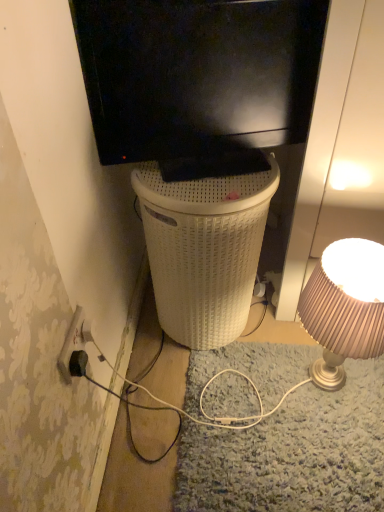
Question: Is white woven basket at center next to black matte television at upper center?

Choices:
 (A) yes
 (B) no

Answer: (B)

Question: Is the position of white woven basket at center more distant than that of black matte television at upper center?

Choices:
 (A) no
 (B) yes

Answer: (B)

Question: Could you tell me if white woven basket at center is turned towards black matte television at upper center?

Choices:
 (A) yes
 (B) no

Answer: (B)

Question: From the image's perspective, does white woven basket at center appear higher than black matte television at upper center?

Choices:
 (A) no
 (B) yes

Answer: (A)

Question: Is white woven basket at center at the left side of black matte television at upper center?

Choices:
 (A) yes
 (B) no

Answer: (A)

Question: Can you confirm if white woven basket at center is thinner than black matte television at upper center?

Choices:
 (A) no
 (B) yes

Answer: (A)

Question: From the image's perspective, is white woven basket at center below black plastic power outlet at lower left?

Choices:
 (A) no
 (B) yes

Answer: (A)

Question: From a real-world perspective, is white woven basket at center physically above black plastic power outlet at lower left?

Choices:
 (A) yes
 (B) no

Answer: (B)

Question: From a real-world perspective, is white woven basket at center beneath black plastic power outlet at lower left?

Choices:
 (A) no
 (B) yes

Answer: (B)

Question: Considering the relative sizes of white woven basket at center and black plastic power outlet at lower left in the image provided, is white woven basket at center taller than black plastic power outlet at lower left?

Choices:
 (A) no
 (B) yes

Answer: (B)

Question: Is white woven basket at center further to the viewer compared to black plastic power outlet at lower left?

Choices:
 (A) no
 (B) yes

Answer: (B)

Question: Is white woven basket at center facing away from black plastic power outlet at lower left?

Choices:
 (A) yes
 (B) no

Answer: (B)

Question: From a real-world perspective, is matte beige lampshade at right positioned over black plastic power outlet at lower left based on gravity?

Choices:
 (A) no
 (B) yes

Answer: (A)